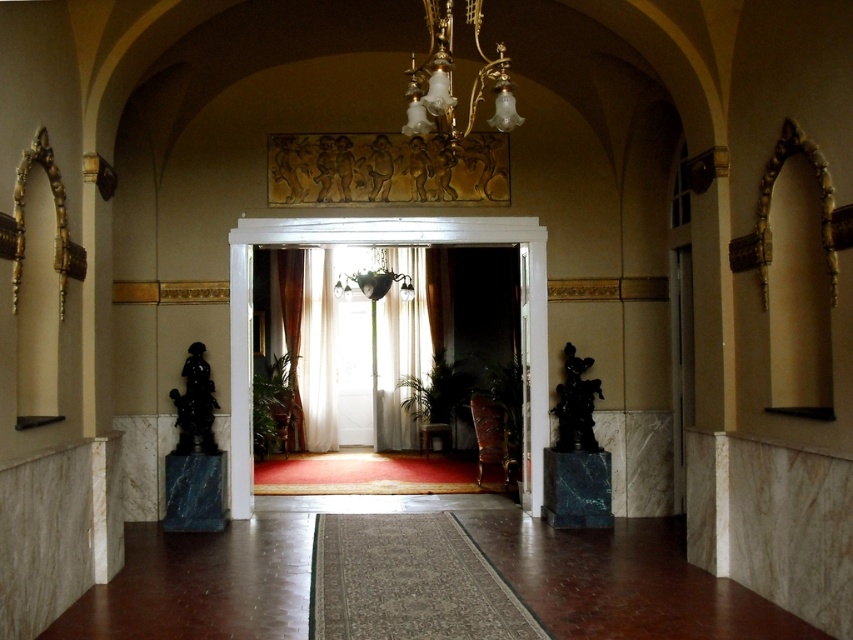
Is matte white door at center to the left of gold/brass chandelier at upper center from the viewer's perspective?

Incorrect, matte white door at center is not on the left side of gold/brass chandelier at upper center.

Does matte white door at center have a lesser width compared to gold/brass chandelier at upper center?

In fact, matte white door at center might be wider than gold/brass chandelier at upper center.

You are a GUI agent. You are given a task and a screenshot of the screen. Output one action in this format:
    pyautogui.click(x=<x>, y=<y>)
    Task: Click on the matte white door at center
    
    Given the screenshot: What is the action you would take?
    coord(386,244)